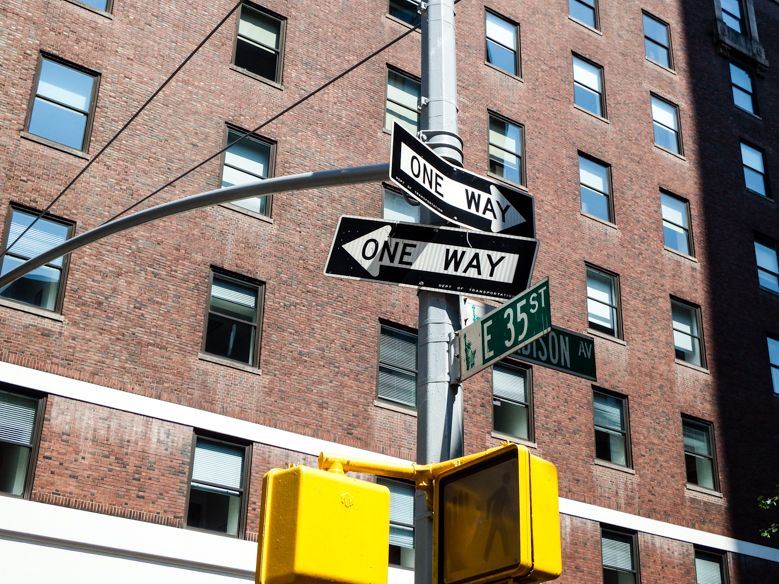
Where is `curtain`? The height and width of the screenshot is (584, 779). curtain is located at coordinates (217, 470).